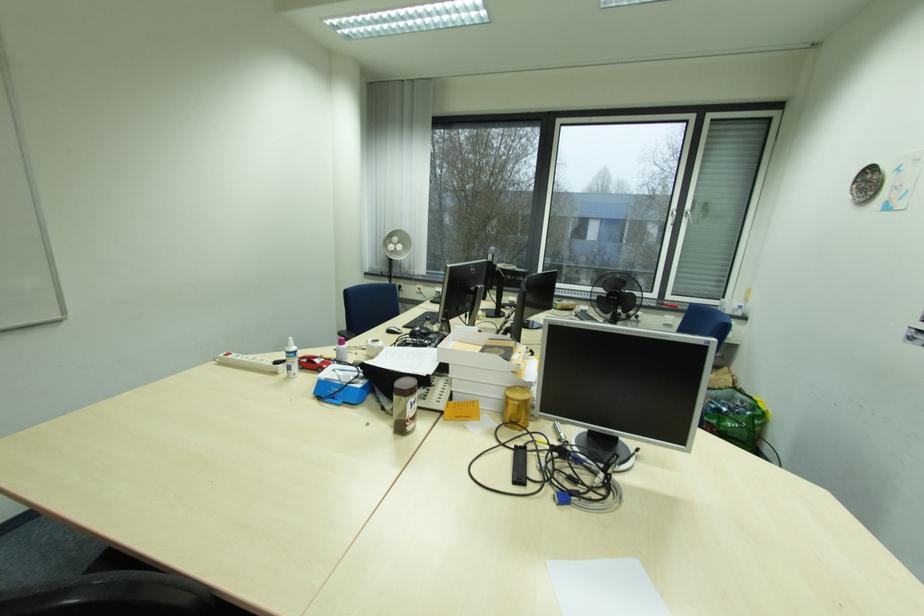
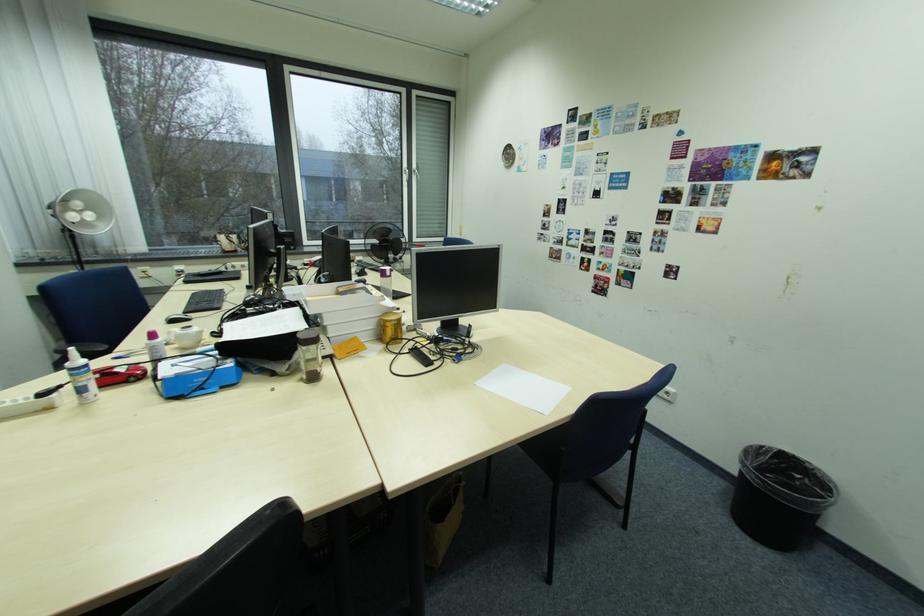
The point at (300, 355) is marked in the first image. Where is the corresponding point in the second image?

(94, 370)